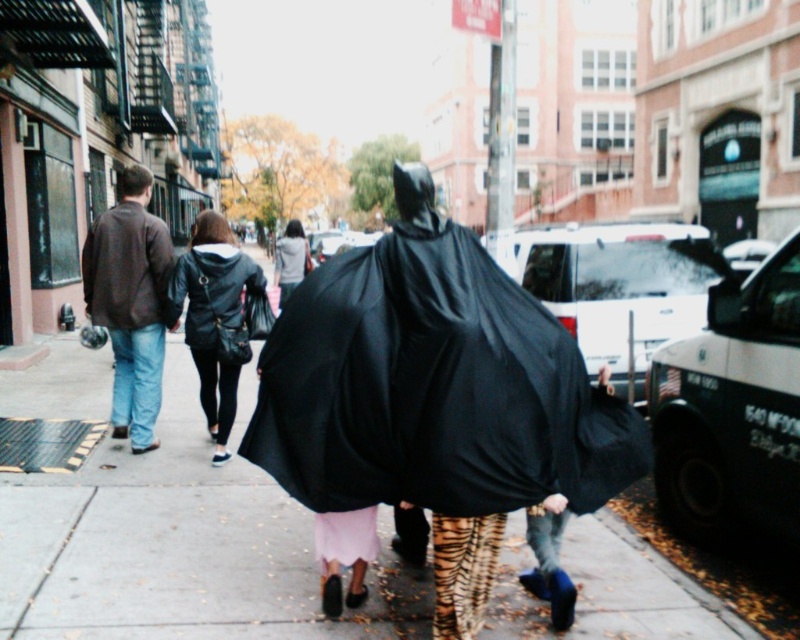
Is black matte cape at center further to the viewer compared to matte black cape at left?

No, it is not.

Can you confirm if black matte cape at center is shorter than matte black cape at left?

Yes, black matte cape at center is shorter than matte black cape at left.

Find the location of `black matte cape at center`. black matte cape at center is located at coordinates coord(432,384).

Can you confirm if gray concrete sidewalk at center is positioned to the left of black matte cape at center?

Indeed, gray concrete sidewalk at center is positioned on the left side of black matte cape at center.

Does gray concrete sidewalk at center have a lesser width compared to black matte cape at center?

Yes.

Is point (204, 589) positioned before point (504, 428)?

No.

Where is `gray concrete sidewalk at center`? The image size is (800, 640). gray concrete sidewalk at center is located at coordinates (178, 547).

Consider the image. Between matte black cape at left and light gray hoodie at center, which one appears on the right side from the viewer's perspective?

Positioned to the right is matte black cape at left.

Which is below, matte black cape at left or light gray hoodie at center?

matte black cape at left is below.

Is point (137, 225) more distant than point (292, 252)?

No, it is in front of (292, 252).

Locate an element on the screen. The image size is (800, 640). matte black cape at left is located at coordinates (130, 308).